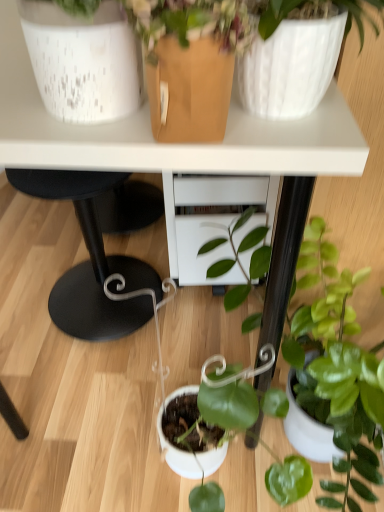
Question: Are white speckled ceramic pot at upper left and white glossy table at upper center located far from each other?

Choices:
 (A) yes
 (B) no

Answer: (B)

Question: From a real-world perspective, is white speckled ceramic pot at upper left below white glossy table at upper center?

Choices:
 (A) no
 (B) yes

Answer: (A)

Question: Are white speckled ceramic pot at upper left and white glossy table at upper center beside each other?

Choices:
 (A) no
 (B) yes

Answer: (A)

Question: Is white speckled ceramic pot at upper left smaller than white glossy table at upper center?

Choices:
 (A) yes
 (B) no

Answer: (A)

Question: Is white speckled ceramic pot at upper left oriented towards white glossy table at upper center?

Choices:
 (A) no
 (B) yes

Answer: (A)

Question: From the image's perspective, would you say white speckled ceramic pot at upper left is shown under white glossy table at upper center?

Choices:
 (A) yes
 (B) no

Answer: (A)

Question: From the image's perspective, does white glossy table at upper center appear lower than white speckled ceramic pot at upper left?

Choices:
 (A) no
 (B) yes

Answer: (A)

Question: Does white glossy table at upper center come in front of white speckled ceramic pot at upper left?

Choices:
 (A) yes
 (B) no

Answer: (B)

Question: Is white glossy table at upper center at the left side of white speckled ceramic pot at upper left?

Choices:
 (A) yes
 (B) no

Answer: (B)

Question: From a real-world perspective, is white glossy table at upper center located beneath white speckled ceramic pot at upper left?

Choices:
 (A) no
 (B) yes

Answer: (B)

Question: Is white glossy table at upper center bigger than white speckled ceramic pot at upper left?

Choices:
 (A) no
 (B) yes

Answer: (B)

Question: Is white speckled ceramic pot at upper left surrounded by white glossy table at upper center?

Choices:
 (A) yes
 (B) no

Answer: (B)

Question: Is white glossy table at upper center closer to the viewer compared to green glossy plant at lower right?

Choices:
 (A) yes
 (B) no

Answer: (B)